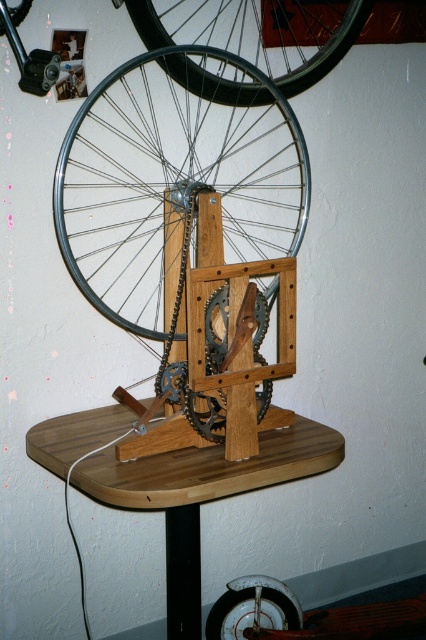
Question: Estimate the real-world distances between objects in this image. Which object is closer to the wooden table at center?

Choices:
 (A) silver metallic bicycle wheel at upper center
 (B) metallic silver wheel at upper left

Answer: (B)

Question: Does wooden table at center have a larger size compared to silver metallic bicycle wheel at upper center?

Choices:
 (A) yes
 (B) no

Answer: (A)

Question: Is metallic silver wheel at upper left smaller than wooden table at center?

Choices:
 (A) yes
 (B) no

Answer: (A)

Question: Estimate the real-world distances between objects in this image. Which object is closer to the metallic silver gear at center?

Choices:
 (A) black rubber tire at upper center
 (B) wooden table at center

Answer: (B)

Question: Which object is the closest to the metallic silver wheel at upper left?

Choices:
 (A) wooden table at center
 (B) metallic silver gear at center
 (C) black rubber tire at upper center

Answer: (C)

Question: Can you confirm if wooden table at center is thinner than metallic silver gear at center?

Choices:
 (A) yes
 (B) no

Answer: (B)